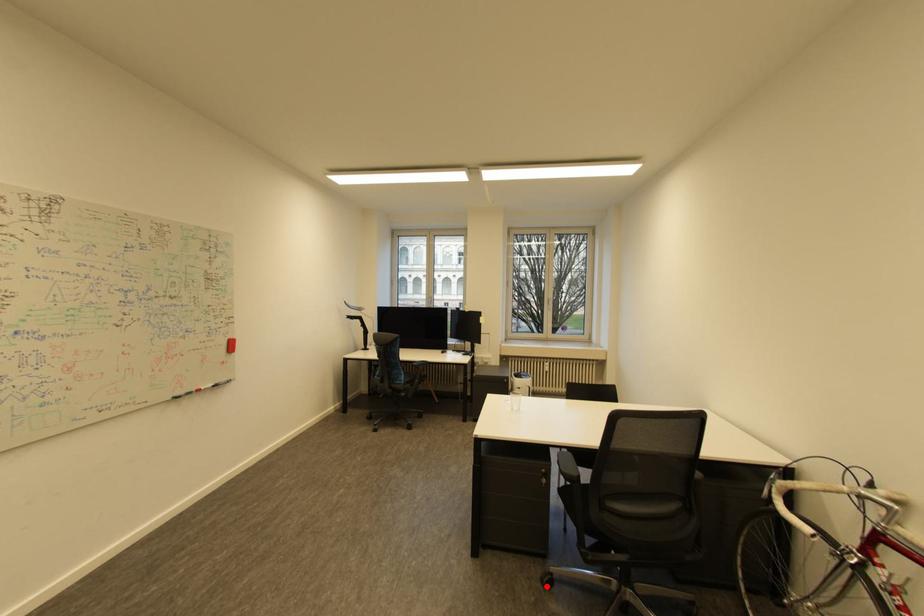
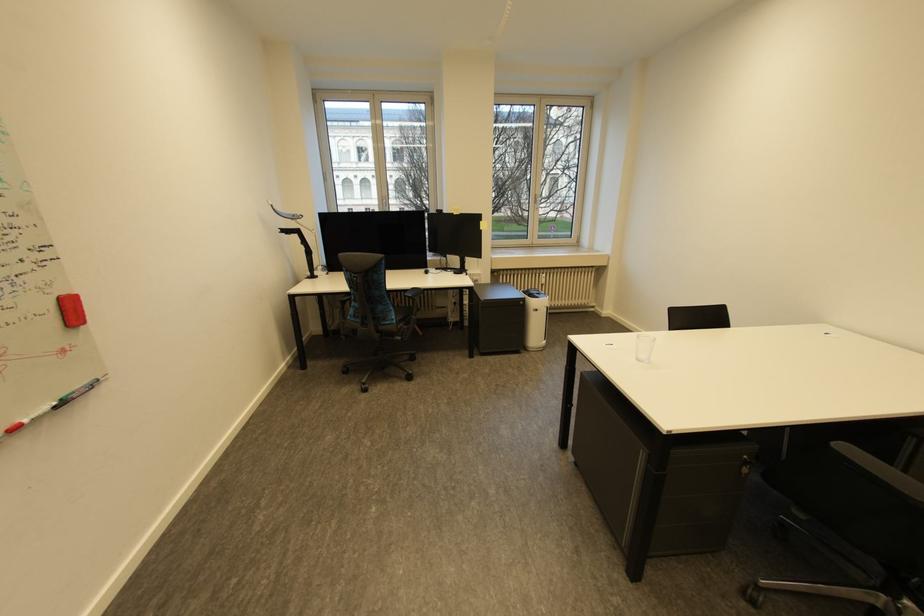
Question: I am providing you with two images of the same scene from different viewpoints. Given a red point in image1, look at the same physical point in image2. Is it:

Choices:
 (A) Closer to the viewpoint
 (B) Farther from the viewpoint

Answer: (A)